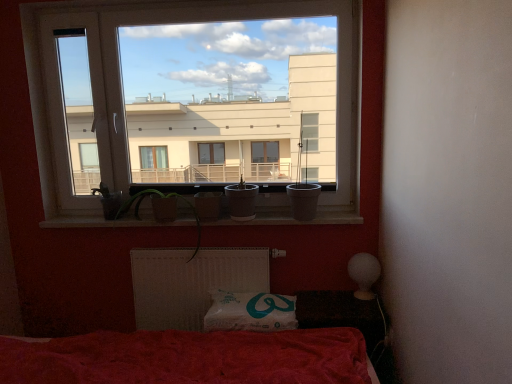
The image size is (512, 384). Find the location of `free point above smooth concrete window sill at center (from a real-world perspective)`. free point above smooth concrete window sill at center (from a real-world perspective) is located at coordinates (211, 218).